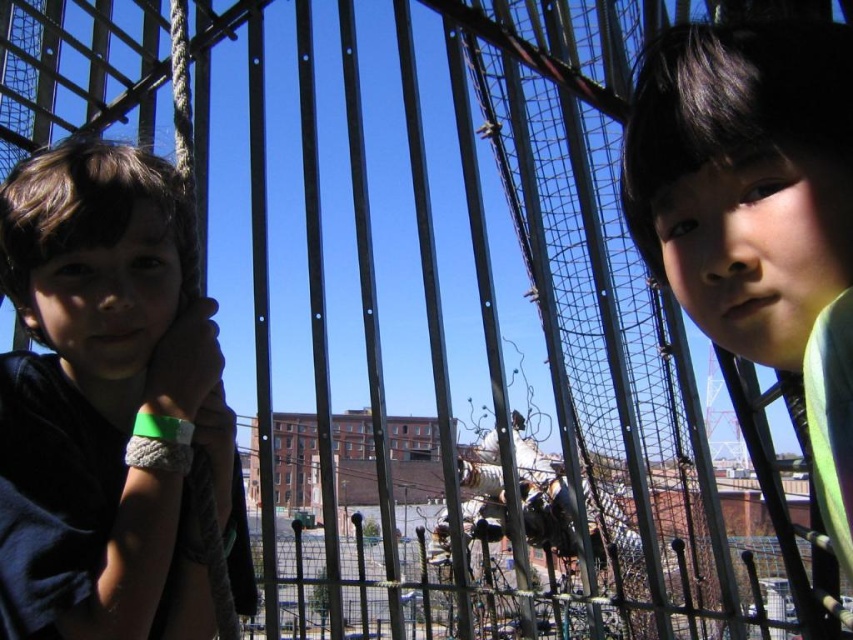
Who is positioned more to the right, dark brown hair at left or smooth green shirt at right?

From the viewer's perspective, smooth green shirt at right appears more on the right side.

Is point (129, 172) closer to camera compared to point (746, 289)?

No.

Does point (183, 477) lie behind point (831, 76)?

That is True.

Where is `dark brown hair at left`? dark brown hair at left is located at coordinates (108, 404).